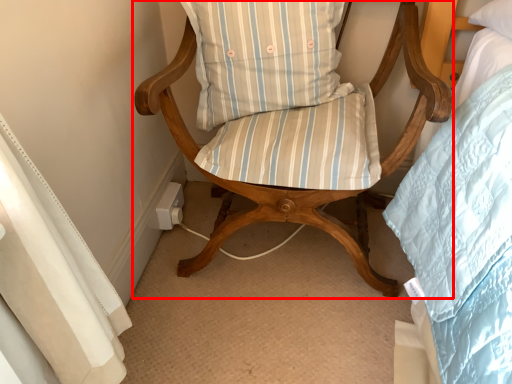
Question: In this image, where is chair (annotated by the red box) located relative to pillow?

Choices:
 (A) left
 (B) right

Answer: (B)